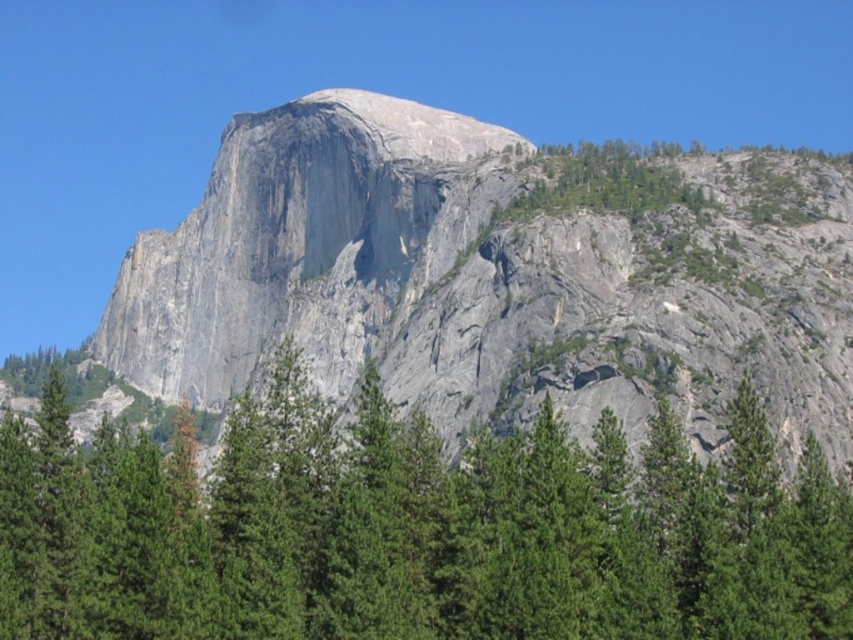
You are planning to take a photo of the gray rock mountain at center and the green textured pine tree at center. Which object will occupy more space in your photo if you keep the camera settings the same?

The gray rock mountain at center will occupy more space in the photo because its width is larger than the green textured pine tree at center.

You are standing at the point labeled as point (x=490, y=278) in the image. What is the object you are currently standing on?

The point (x=490, y=278) indicates that you are standing on the gray rock mountain at center.